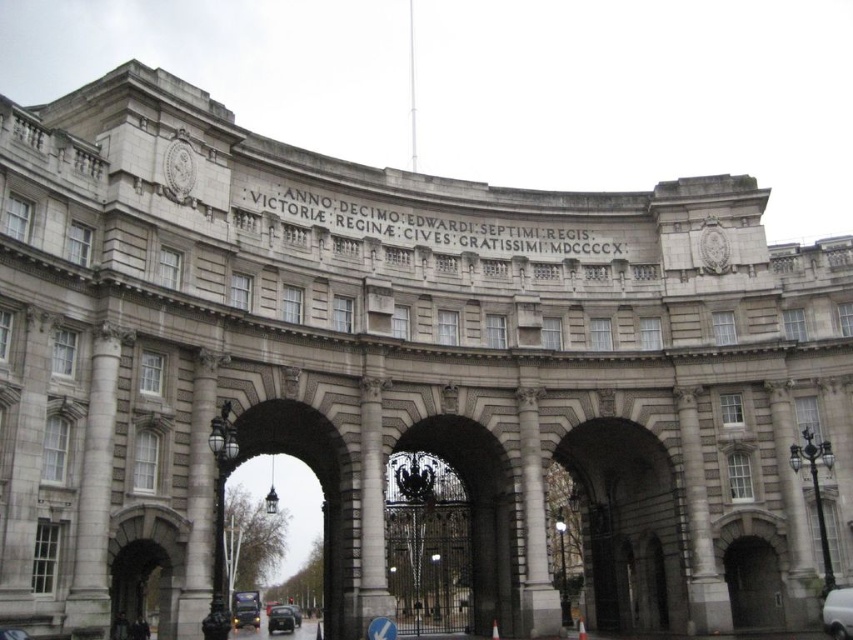
You are driving a car and approaching a gray stone archway at center and a black glossy car at center. Which object is closer to you as you drive towards them?

The gray stone archway at center is in front of the black glossy car at center, so the gray stone archway at center is closer to you as you drive towards them.

In the scene shown: You are a photographer positioned at the entrance of the grand classical building. You want to capture a photo that includes both the gray stone archway at center and the shiny black car at center. Based on their positions, which object should you pan your camera to the right to include in the frame?

The gray stone archway at center is to the right of the shiny black car at center. To include both in the frame, you should pan your camera to the right to include the gray stone archway at center.